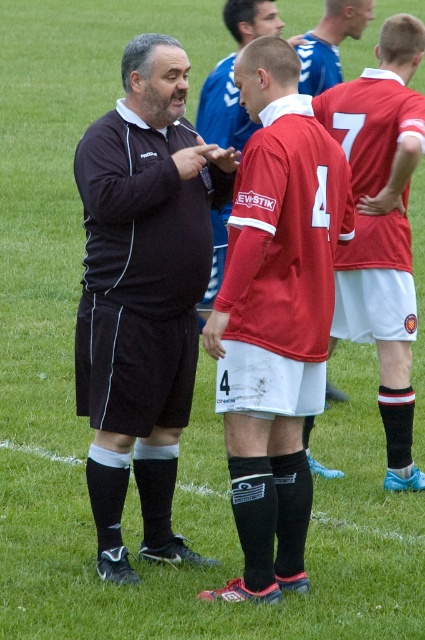
Question: Does red matte jersey at center appear under matte red jersey at center?

Choices:
 (A) yes
 (B) no

Answer: (A)

Question: Which of the following is the closest to the observer?

Choices:
 (A) (346, 324)
 (B) (340, 1)

Answer: (A)

Question: Among these points, which one is farthest from the camera?

Choices:
 (A) (125, 324)
 (B) (365, 218)
 (C) (240, 28)
 (D) (357, 1)

Answer: (D)

Question: Which object is closer to the camera taking this photo?

Choices:
 (A) matte red jersey at center
 (B) matte black shorts at center
 (C) red matte jersey at center

Answer: (B)

Question: Can you confirm if red matte jersey at center is positioned to the right of blue jersey at center?

Choices:
 (A) yes
 (B) no

Answer: (A)

Question: Is matte red jersey at center to the right of blue jersey at center from the viewer's perspective?

Choices:
 (A) yes
 (B) no

Answer: (B)